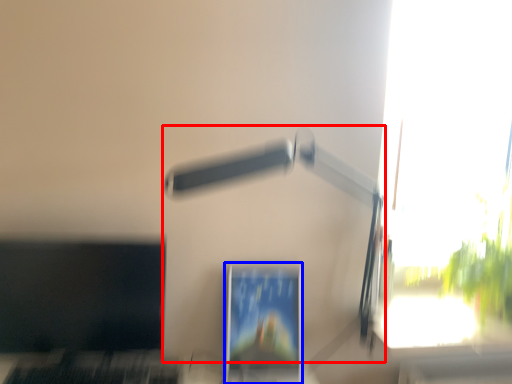
Question: Among these objects, which one is nearest to the camera, lamp (highlighted by a red box) or computer monitor (highlighted by a blue box)?

Choices:
 (A) lamp
 (B) computer monitor

Answer: (A)